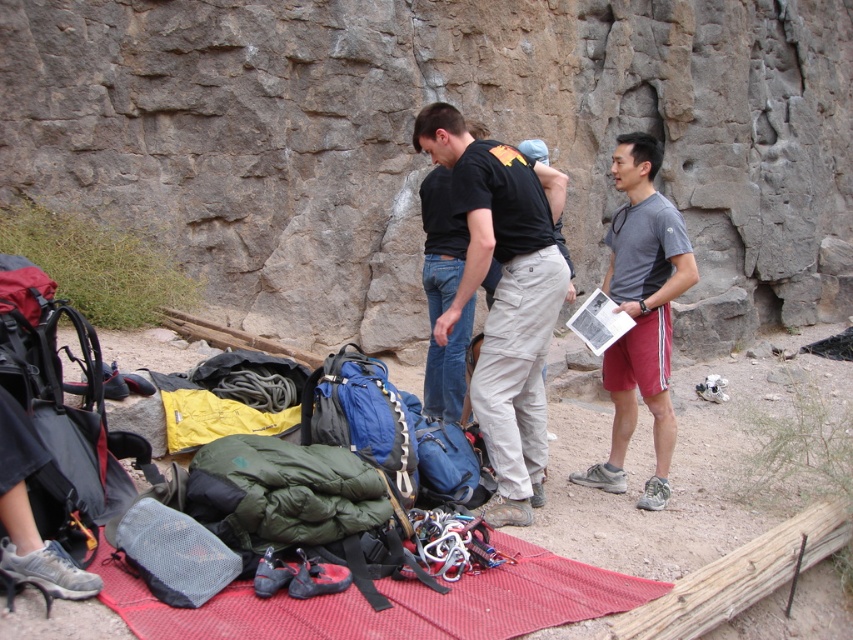
Question: Considering the relative positions of red rubber mat at lower center and gray cotton t-shirt at center in the image provided, where is red rubber mat at lower center located with respect to gray cotton t-shirt at center?

Choices:
 (A) left
 (B) right

Answer: (A)

Question: Estimate the real-world distances between objects in this image. Which object is closer to the gray rough rock face at center?

Choices:
 (A) gray cotton t-shirt at center
 (B) red rubber mat at lower center

Answer: (A)

Question: Is red rubber mat at lower center further to camera compared to gray cotton t-shirt at center?

Choices:
 (A) no
 (B) yes

Answer: (A)

Question: Which point appears farthest from the camera in this image?

Choices:
 (A) (654, 243)
 (B) (434, 618)

Answer: (A)

Question: Which point appears farthest from the camera in this image?

Choices:
 (A) (511, 541)
 (B) (705, 161)

Answer: (B)

Question: Is black cotton t-shirt at center positioned at the back of red rubber mat at lower center?

Choices:
 (A) no
 (B) yes

Answer: (B)